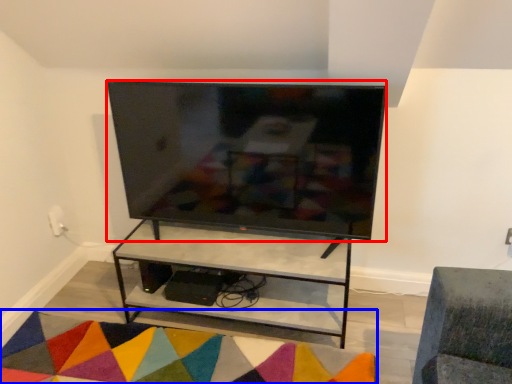
Question: Which point is closer to the camera, television (highlighted by a red box) or mat (highlighted by a blue box)?

Choices:
 (A) television
 (B) mat

Answer: (B)